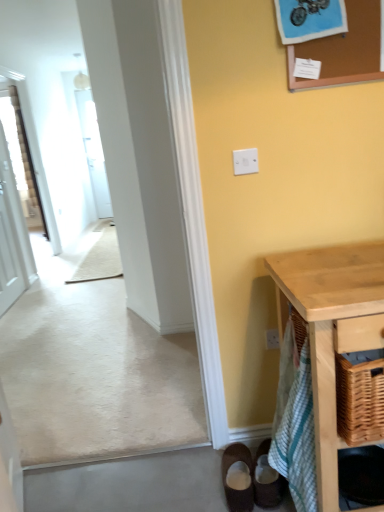
What do you see at coordinates (245, 161) in the screenshot?
I see `white plastic light switch at center` at bounding box center [245, 161].

The width and height of the screenshot is (384, 512). I want to click on white plastic light switch at center, so click(245, 161).

This screenshot has width=384, height=512. Find the location of `green striped cloth at lower right`. green striped cloth at lower right is located at coordinates click(295, 424).

Would you say white plastic light switch at center is a long distance from light wood table at lower right?

Actually, white plastic light switch at center and light wood table at lower right are a little close together.

Which object is thinner, white plastic light switch at center or light wood table at lower right?

With smaller width is white plastic light switch at center.

From a real-world perspective, who is located higher, white plastic light switch at center or light wood table at lower right?

white plastic light switch at center, from a real-world perspective.

Is the depth of white glossy door at left less than that of green striped cloth at lower right?

No, white glossy door at left is further to the viewer.

Is white glossy door at left beside green striped cloth at lower right?

They are not placed beside each other.

In terms of height, does white glossy door at left look taller or shorter compared to green striped cloth at lower right?

Considering their sizes, white glossy door at left has more height than green striped cloth at lower right.

From a real-world perspective, which is physically above, brown suede shoes at lower center, marked as the first footwear in a left-to-right arrangement, or corkboard at upper right?

corkboard at upper right is physically above.

Which object is thinner, brown suede shoes at lower center, marked as the first footwear in a left-to-right arrangement, or corkboard at upper right?

Thinner between the two is corkboard at upper right.

Is brown suede shoes at lower center, marked as the first footwear in a left-to-right arrangement, at the right side of corkboard at upper right?

Incorrect, brown suede shoes at lower center, marked as the first footwear in a left-to-right arrangement, is not on the right side of corkboard at upper right.

Which of these two, white glossy door at left or brown suede shoes at lower right, which is the 2th footwear in left-to-right order, is wider?

Wider between the two is brown suede shoes at lower right, which is the 2th footwear in left-to-right order.

Consider the image. Is white glossy door at left taller or shorter than brown suede shoes at lower right, positioned as the first footwear in right-to-left order?

Considering their sizes, white glossy door at left has more height than brown suede shoes at lower right, positioned as the first footwear in right-to-left order.

From a real-world perspective, which is physically above, white glossy door at left or brown suede shoes at lower right, positioned as the first footwear in right-to-left order?

From a 3D spatial view, white glossy door at left is above.

Considering their positions, is white glossy door at left located in front of or behind brown suede shoes at lower right, which is the 2th footwear in left-to-right order?

white glossy door at left is behind brown suede shoes at lower right, which is the 2th footwear in left-to-right order.

How different are the orientations of light wood table at lower right and white glossy door at left in degrees?

The angle between the facing direction of light wood table at lower right and the facing direction of white glossy door at left is 88.8 degrees.

Does point (337, 278) come in front of point (5, 200)?

Yes, it is.

Which of these two, light wood table at lower right or white glossy door at left, stands taller?

Standing taller between the two is white glossy door at left.

From a real-world perspective, is white plastic light switch at center positioned under green striped cloth at lower right based on gravity?

No.

Which is more to the left, white plastic light switch at center or green striped cloth at lower right?

Positioned to the left is white plastic light switch at center.

Could you tell me if white plastic light switch at center is facing green striped cloth at lower right?

No, white plastic light switch at center does not turn towards green striped cloth at lower right.

Are white glossy door at left and white plastic light switch at center far apart?

That's right, there is a large distance between white glossy door at left and white plastic light switch at center.

What's the angular difference between white glossy door at left and white plastic light switch at center's facing directions?

The angular difference between white glossy door at left and white plastic light switch at center is 88.8 degrees.

Would you say white glossy door at left contains white plastic light switch at center?

No, white plastic light switch at center is located outside of white glossy door at left.

From their relative heights in the image, would you say white glossy door at left is taller or shorter than white plastic light switch at center?

Considering their sizes, white glossy door at left has more height than white plastic light switch at center.

The image size is (384, 512). Identify the location of table below the white plastic light switch at center (from a real-world perspective). (331, 329).

There is a green striped cloth at lower right. Where is `door above it (from a real-world perspective)`? This screenshot has height=512, width=384. door above it (from a real-world perspective) is located at coordinates (12, 234).

Based on their spatial positions, is light wood table at lower right or brown suede shoes at lower right, which is the 2th footwear in left-to-right order, further from brown suede shoes at lower center, marked as the first footwear in a left-to-right arrangement?

Based on the image, light wood table at lower right appears to be further to brown suede shoes at lower center, marked as the first footwear in a left-to-right arrangement.

Looking at the image, which one is located further to light wood table at lower right, green striped cloth at lower right or corkboard at upper right?

corkboard at upper right lies further to light wood table at lower right than the other object.

Based on their spatial positions, is white plastic light switch at center or green striped cloth at lower right closer to brown suede shoes at lower center, marked as the first footwear in a left-to-right arrangement?

green striped cloth at lower right lies closer to brown suede shoes at lower center, marked as the first footwear in a left-to-right arrangement, than the other object.

Based on their spatial positions, is light wood table at lower right or white glossy door at left further from white plastic light switch at center?

Based on the image, white glossy door at left appears to be further to white plastic light switch at center.

Based on their spatial positions, is green striped cloth at lower right or white glossy door at left further from corkboard at upper right?

Based on the image, white glossy door at left appears to be further to corkboard at upper right.

Based on their spatial positions, is brown suede shoes at lower right, which is the 2th footwear in left-to-right order, or white plastic light switch at center closer to brown suede shoes at lower center, the second footwear positioned from the right?

brown suede shoes at lower right, which is the 2th footwear in left-to-right order, lies closer to brown suede shoes at lower center, the second footwear positioned from the right, than the other object.

Considering their positions, is light wood table at lower right positioned closer to brown suede shoes at lower right, which is the 2th footwear in left-to-right order, than white plastic light switch at center?

Based on the image, light wood table at lower right appears to be nearer to brown suede shoes at lower right, which is the 2th footwear in left-to-right order.

Looking at this image, which object lies further to the anchor point corkboard at upper right, white glossy door at left or white plastic light switch at center?

white glossy door at left.

Locate an element on the screen. bath towel between white glossy door at left and light wood table at lower right is located at coordinates (295, 424).

Where is `footwear that lies between white plastic light switch at center and brown suede shoes at lower center, marked as the first footwear in a left-to-right arrangement, from top to bottom`? footwear that lies between white plastic light switch at center and brown suede shoes at lower center, marked as the first footwear in a left-to-right arrangement, from top to bottom is located at coordinates (267, 479).

At what (x,y) coordinates should I click in order to perform the action: click on footwear situated between white glossy door at left and white plastic light switch at center from left to right. Please return your answer as a coordinate pair (x, y). Image resolution: width=384 pixels, height=512 pixels. Looking at the image, I should click on (238, 471).

The height and width of the screenshot is (512, 384). Find the location of `light switch between corkboard at upper right and green striped cloth at lower right vertically`. light switch between corkboard at upper right and green striped cloth at lower right vertically is located at coordinates (245, 161).